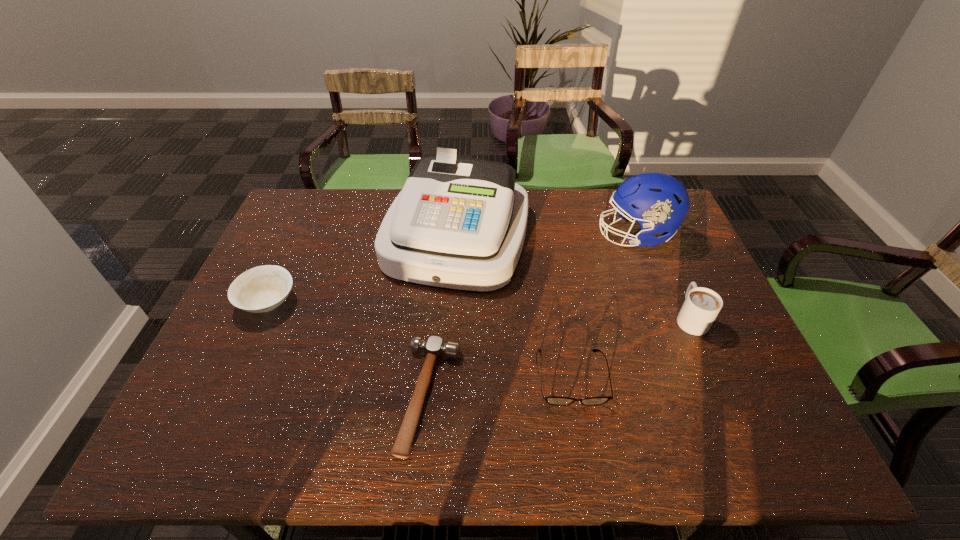
This screenshot has width=960, height=540. I want to click on vacant space located 0.330m on the face guard of the football helmet, so [x=492, y=235].

The width and height of the screenshot is (960, 540). In order to click on free spot located 0.120m on the side with the handle of the fourth shortest object in this screenshot , I will do `click(669, 270)`.

Find the location of a particular element. This screenshot has height=540, width=960. vacant space situated 0.090m on the side with the handle of the fourth shortest object is located at coordinates (673, 278).

This screenshot has width=960, height=540. What are the coordinates of `free space located 0.260m on the side with the handle of the fourth shortest object` in the screenshot? It's located at (656, 239).

Where is `vacant area located on the right of the third shortest object`? The image size is (960, 540). vacant area located on the right of the third shortest object is located at coordinates (375, 302).

Find the location of `vacant space located 0.110m on the front-facing side of the spectacles`. vacant space located 0.110m on the front-facing side of the spectacles is located at coordinates (585, 458).

Image resolution: width=960 pixels, height=540 pixels. Find the location of `free space located on the back of the hammer`. free space located on the back of the hammer is located at coordinates (441, 276).

In order to click on cash register present at the far edge in this screenshot , I will do `click(459, 223)`.

The image size is (960, 540). In order to click on football helmet at the far edge in this screenshot , I will do `click(659, 203)`.

The height and width of the screenshot is (540, 960). I want to click on object located in the near edge section of the desktop, so tap(434, 347).